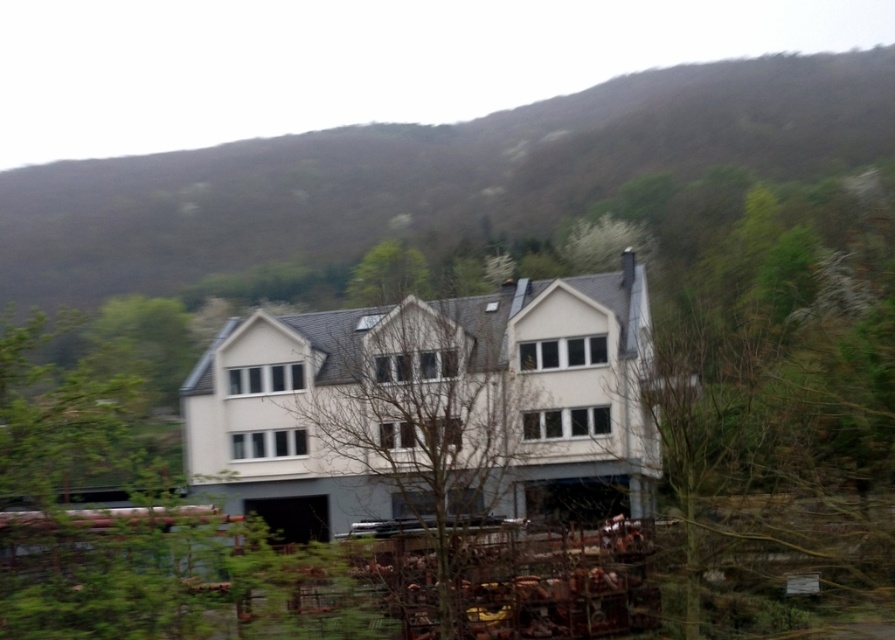
Which is behind, point (239, 464) or point (162, 276)?

The point (162, 276) is behind.

Between point (743, 451) and point (50, 273), which one is positioned in front?

Point (743, 451) is in front.

Where is `green leafy tree at center`? green leafy tree at center is located at coordinates (612, 401).

Which is more to the right, green leafy tree at center or bare branches at center?

From the viewer's perspective, green leafy tree at center appears more on the right side.

Who is positioned more to the left, green leafy tree at center or bare branches at center?

bare branches at center

This screenshot has width=895, height=640. Describe the element at coordinates (612, 401) in the screenshot. I see `green leafy tree at center` at that location.

Find the location of a particular element. This screenshot has width=895, height=640. green leafy tree at center is located at coordinates (612, 401).

Does green forested mountain at upper center have a smaller size compared to bare branches at center?

No.

Which is in front, point (841, 74) or point (470, 381)?

Point (470, 381)

You are a GUI agent. You are given a task and a screenshot of the screen. Output one action in this format:
    pyautogui.click(x=<x>, y=<y>)
    Task: Click on the green forested mountain at upper center
    This screenshot has height=640, width=895.
    Given the screenshot: What is the action you would take?
    pyautogui.click(x=425, y=173)